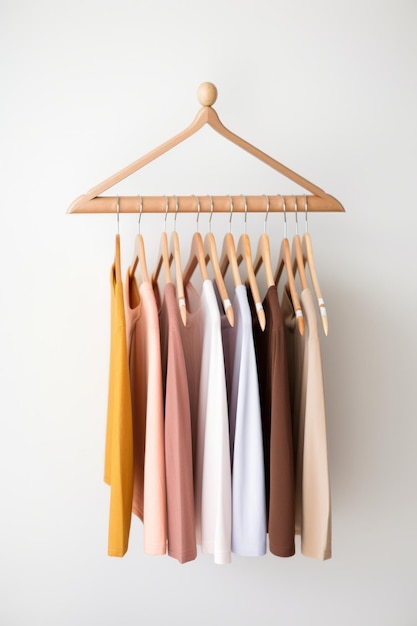
In order to click on empty hangers in this screenshot , I will do `click(179, 272)`, `click(219, 272)`, `click(253, 284)`, `click(283, 249)`, `click(306, 252)`.